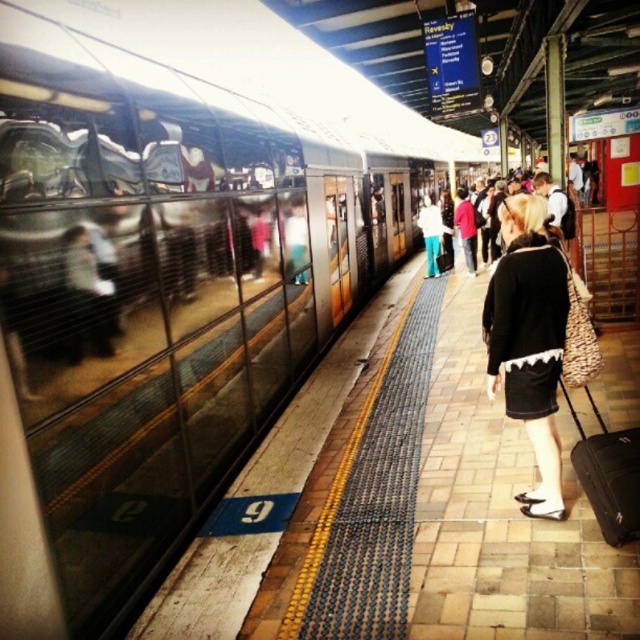
You are a photographer trying to capture a shot of the black matte skirt at center and the black fabric suitcase at lower right. If you want to ensure both items are fully visible in the frame, which one should you focus on first considering their widths?

The black matte skirt at center might be wider than black fabric suitcase at lower right, so you should focus on the black matte skirt at center first to ensure it fits within the frame.

You are a passenger waiting at the train station platform. You see the black matte skirt at center and the black fabric suitcase at lower right. Which object is closer to the tactile paving strip along the edge of the platform?

The black fabric suitcase at lower right is closer to the tactile paving strip along the edge of the platform because it is positioned to the right of the black matte skirt at center, which is closer to the platform edge marked by the tactile paving strip.